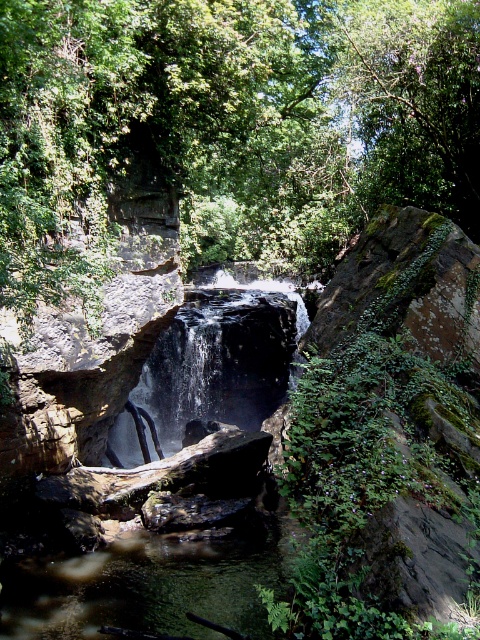
Which of these two, green leafy tree at center or clear water at center, stands taller?

green leafy tree at center

Locate an element on the screen. This screenshot has width=480, height=640. green leafy tree at center is located at coordinates (228, 129).

Is green leafy tree at upper center above clear water at center?

Yes, green leafy tree at upper center is above clear water at center.

Which is in front, point (474, 182) or point (153, 372)?

Point (474, 182) is in front.

Identify the location of green leafy tree at upper center. Image resolution: width=480 pixels, height=640 pixels. [411, 100].

Between green leafy tree at center and green leafy tree at upper center, which one has more height?

green leafy tree at center

Can you confirm if green leafy tree at center is taller than green leafy tree at upper center?

Yes, green leafy tree at center is taller than green leafy tree at upper center.

Is point (93, 216) positioned before point (384, 170)?

That is True.

Identify the location of green leafy tree at center. The height and width of the screenshot is (640, 480). (228, 129).